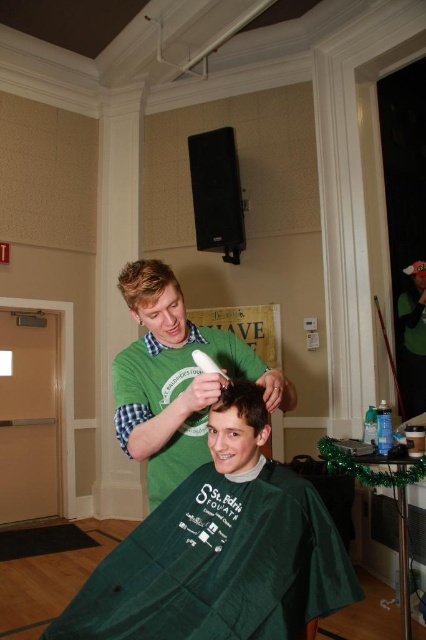
Question: Does green matte shirt at center appear on the right side of brown matte hair at center?

Choices:
 (A) no
 (B) yes

Answer: (A)

Question: Which point is farther to the camera?

Choices:
 (A) (192, 380)
 (B) (150, 260)

Answer: (B)

Question: Which is nearer to the green fabric cape at center?

Choices:
 (A) green matte shirt at center
 (B) blonde hair at upper center

Answer: (A)

Question: Is the position of green fabric cape at center more distant than that of green matte shirt at center?

Choices:
 (A) no
 (B) yes

Answer: (A)

Question: Which object is the farthest from the green matte shirt at center?

Choices:
 (A) brown matte hair at center
 (B) blonde hair at upper center
 (C) green fabric cape at center

Answer: (C)

Question: Is green fabric cape at center below blonde hair at upper center?

Choices:
 (A) yes
 (B) no

Answer: (A)